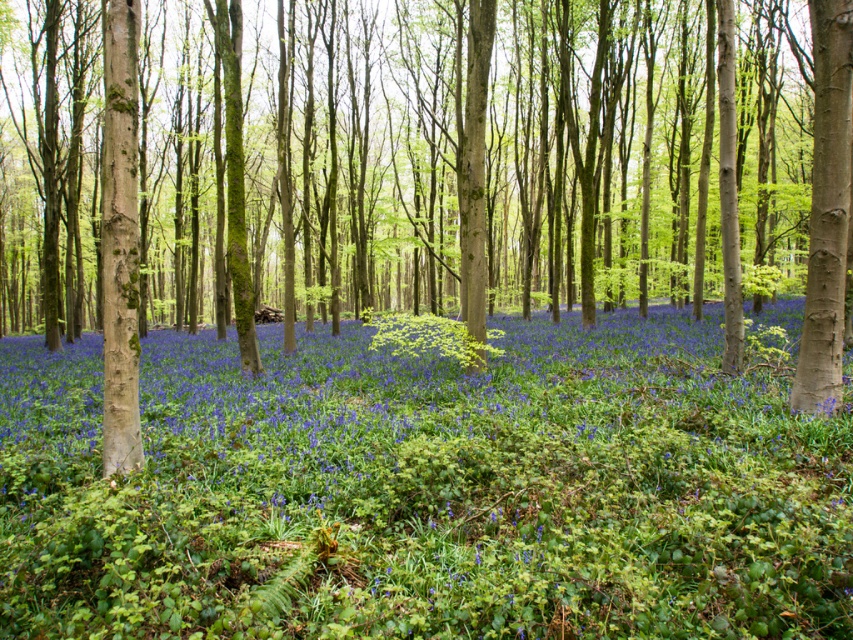
You are standing in the forest and see the point marked at coordinate (827, 209). Based on the scene description, can you identify what object this point is located on?

The point at coordinate (827, 209) is located on the smooth brown tree trunk at right.

You are standing in the forest and see two points marked in the image. Which point is closer to you, point (514, 404) or point (849, 1)?

Point (514, 404) is further to the viewer than point (849, 1), so the closer point to you is point (849, 1).

Looking at this image, you are a botanist examining the forest floor. You notice the blue matte flowers at center and the vibrant green leaves at center. Which object is positioned lower in the scene?

The blue matte flowers at center are located below the vibrant green leaves at center, so they are positioned lower in the scene.